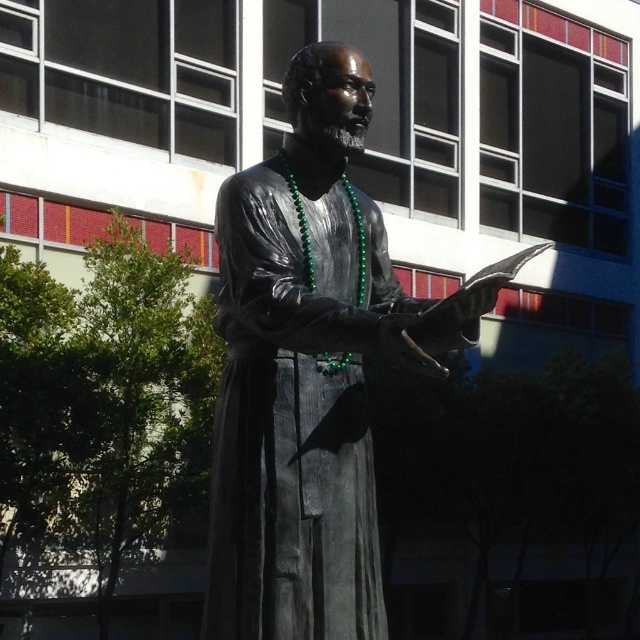
You are standing at the point with coordinates [310,369] in the image. What object are you directly at?

The point at coordinates [310,369] corresponds to the bronze statue at center.

You are standing in front of the modern building and see the bronze statue at center and the bronze textured robe at center. Which object is positioned to the left?

The bronze textured robe at center is positioned to the left of the bronze statue at center.

You are an art student analyzing the statue. You notice the bronze statue at center and the bronze textured robe at center. Which object has a greater width?

The bronze statue at center has a greater width than the bronze textured robe at center.